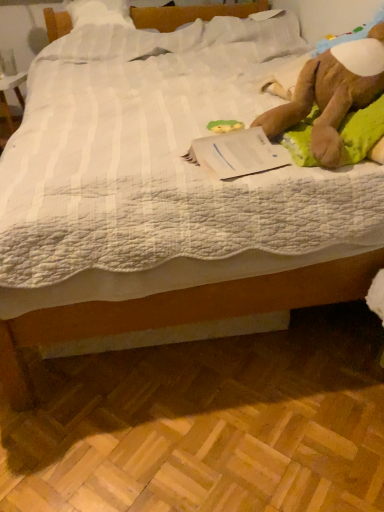
Locate an element on the screen. The height and width of the screenshot is (512, 384). white paper at upper right is located at coordinates (237, 153).

The image size is (384, 512). I want to click on brown plush toy at upper right, so click(332, 93).

Find the location of a particular element. The height and width of the screenshot is (512, 384). green rubber duck at center is located at coordinates (224, 126).

This screenshot has height=512, width=384. Find the location of `white paper at upper right`. white paper at upper right is located at coordinates (237, 153).

Is brown plush toy at upper right positioned behind green rubber duck at center?

No, brown plush toy at upper right is closer to the camera.

From a real-world perspective, is brown plush toy at upper right above or below green rubber duck at center?

brown plush toy at upper right is situated higher than green rubber duck at center in the real world.

Based on the photo, are brown plush toy at upper right and green rubber duck at center far apart?

No, brown plush toy at upper right is not far from green rubber duck at center.

Is brown plush toy at upper right bigger than green rubber duck at center?

Yes.

Does point (217, 146) lie behind point (300, 83)?

No, (217, 146) is in front of (300, 83).

Between white paper at upper right and brown plush toy at upper right, which one has larger width?

With larger width is brown plush toy at upper right.

From the picture: From the image's perspective, is white paper at upper right located above brown plush toy at upper right?

No, from the image's perspective, white paper at upper right is not on top of brown plush toy at upper right.

Is brown plush toy at upper right inside white paper at upper right?

No.

Is green rubber duck at center positioned before white paper at upper right?

That is False.

Does green rubber duck at center have a lesser width compared to white paper at upper right?

Yes, green rubber duck at center is thinner than white paper at upper right.

Does green rubber duck at center turn towards white paper at upper right?

No, green rubber duck at center is not aimed at white paper at upper right.

What are the coordinates of `toy on the right of white paper at upper right` in the screenshot? It's located at (224, 126).

Is white paper at upper right in front of green rubber duck at center?

Yes.

Is white paper at upper right oriented away from green rubber duck at center?

white paper at upper right does not have its back to green rubber duck at center.

Locate an element on the screen. toy behind the white paper at upper right is located at coordinates (224, 126).

In the scene shown: Which is further, (281, 130) or (227, 157)?

The point (281, 130) is farther from the camera.

Is brown plush toy at upper right facing towards white paper at upper right?

No, brown plush toy at upper right is not oriented towards white paper at upper right.

Considering the relative positions of brown plush toy at upper right and white paper at upper right in the image provided, is brown plush toy at upper right to the right of white paper at upper right from the viewer's perspective?

Correct, you'll find brown plush toy at upper right to the right of white paper at upper right.

Is green rubber duck at center not close to brown plush toy at upper right?

No, green rubber duck at center is in close proximity to brown plush toy at upper right.

Is point (210, 125) closer to viewer compared to point (376, 65)?

No, (210, 125) is behind (376, 65).

In the scene shown: Which object is more forward, green rubber duck at center or brown plush toy at upper right?

brown plush toy at upper right is closer to the camera.

What are the coordinates of `toy below the brown plush toy at upper right (from a real-world perspective)` in the screenshot? It's located at (224, 126).

Identify the location of animal that appears above the white paper at upper right (from the image's perspective). This screenshot has height=512, width=384. click(x=332, y=93).

Considering their positions, is green rubber duck at center positioned further to brown plush toy at upper right than white paper at upper right?

green rubber duck at center.

Considering their positions, is white paper at upper right positioned closer to brown plush toy at upper right than green rubber duck at center?

Based on the image, white paper at upper right appears to be nearer to brown plush toy at upper right.

Considering their positions, is white paper at upper right positioned further to green rubber duck at center than brown plush toy at upper right?

Based on the image, brown plush toy at upper right appears to be further to green rubber duck at center.

Based on their spatial positions, is brown plush toy at upper right or green rubber duck at center further from white paper at upper right?

green rubber duck at center lies further to white paper at upper right than the other object.

Which object lies nearer to the anchor point green rubber duck at center, brown plush toy at upper right or white paper at upper right?

Based on the image, white paper at upper right appears to be nearer to green rubber duck at center.

Considering their positions, is green rubber duck at center positioned closer to white paper at upper right than brown plush toy at upper right?

brown plush toy at upper right is closer to white paper at upper right.

Where is `paperback book between brown plush toy at upper right and green rubber duck at center from front to back`? The height and width of the screenshot is (512, 384). paperback book between brown plush toy at upper right and green rubber duck at center from front to back is located at coordinates (237, 153).